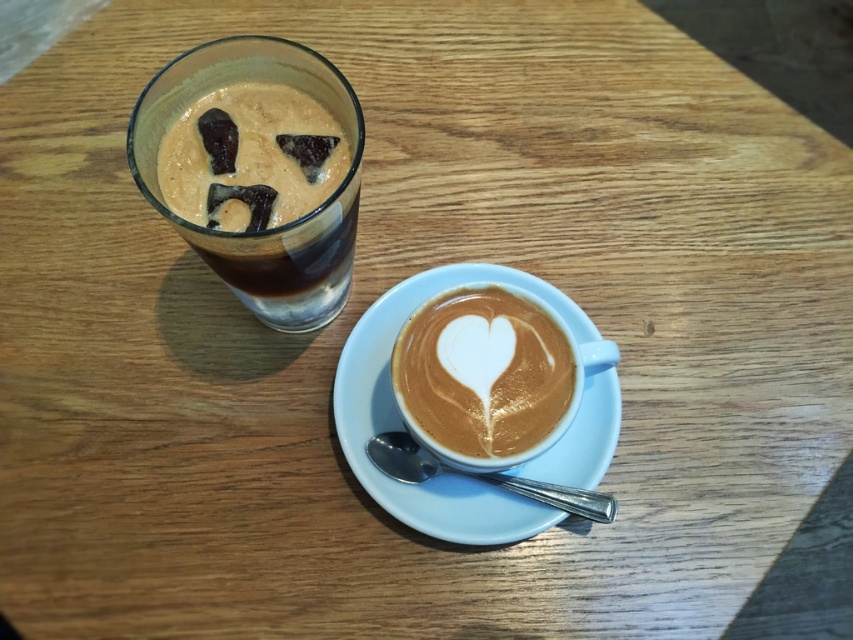
Question: Does white ceramic saucer at center appear over white frothy latte art at center?

Choices:
 (A) no
 (B) yes

Answer: (A)

Question: In this image, where is white ceramic saucer at center located relative to matte brown glass at upper left?

Choices:
 (A) left
 (B) right

Answer: (B)

Question: Based on their relative distances, which object is farther from the white frothy latte art at center?

Choices:
 (A) matte brown glass at upper left
 (B) white ceramic saucer at center

Answer: (A)

Question: Which of the following is the farthest from the observer?

Choices:
 (A) (598, 410)
 (B) (351, 113)

Answer: (A)

Question: Which point is closer to the camera?

Choices:
 (A) (511, 365)
 (B) (367, 480)

Answer: (A)

Question: Can you confirm if white ceramic saucer at center is wider than white frothy latte art at center?

Choices:
 (A) yes
 (B) no

Answer: (A)